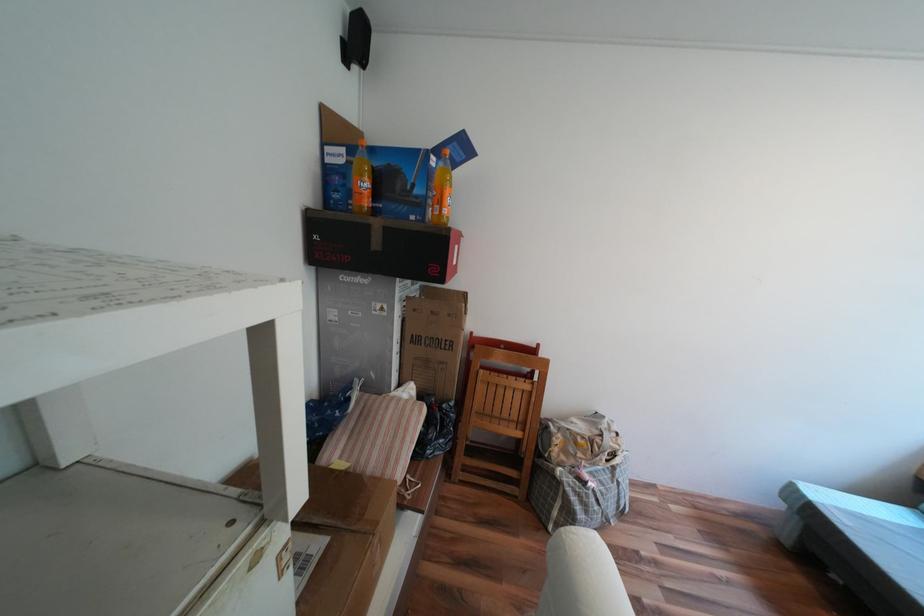
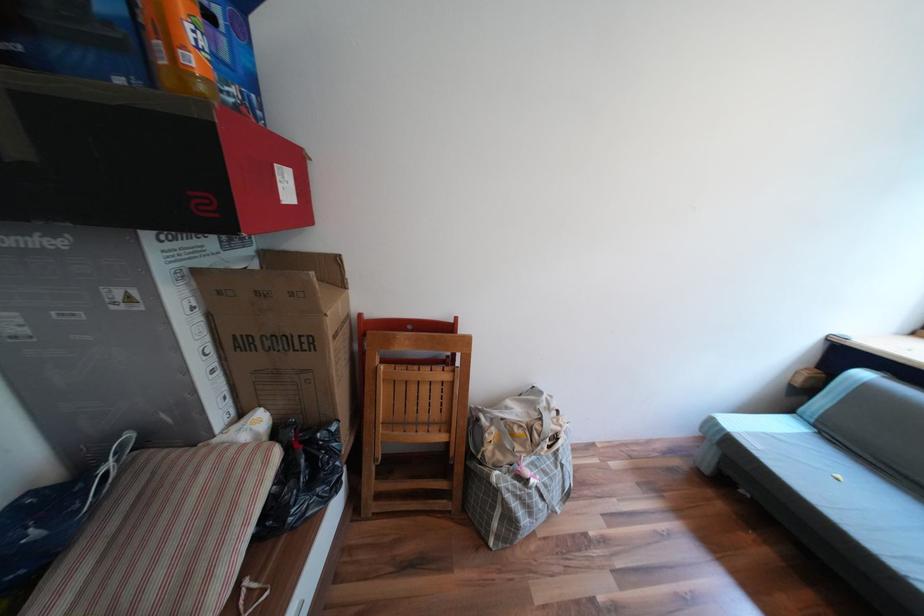
The point at (420,411) is marked in the first image. Where is the corresponding point in the second image?

(258, 464)